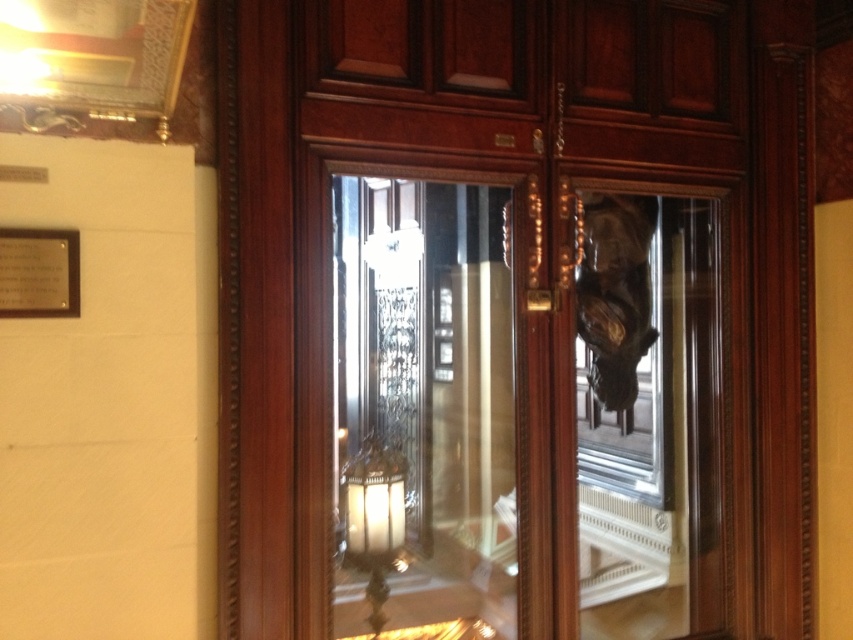
Question: Which of the following is the closest to the observer?

Choices:
 (A) transparent glass door at center
 (B) clear glass door at center

Answer: (B)

Question: Can you confirm if transparent glass door at center is bigger than clear glass door at center?

Choices:
 (A) no
 (B) yes

Answer: (B)

Question: Which point is farther from the camera taking this photo?

Choices:
 (A) pyautogui.click(x=486, y=552)
 (B) pyautogui.click(x=355, y=637)

Answer: (A)

Question: Is transparent glass door at center to the left of clear glass door at center from the viewer's perspective?

Choices:
 (A) no
 (B) yes

Answer: (A)

Question: Where is transparent glass door at center located in relation to clear glass door at center in the image?

Choices:
 (A) above
 (B) below

Answer: (A)